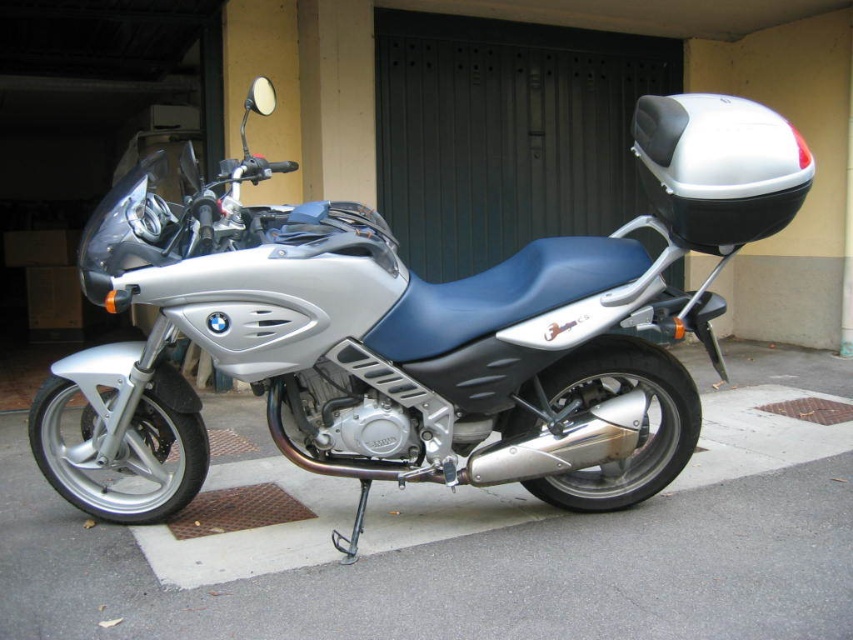
Is point (410, 310) positioned before point (453, 500)?

Yes, point (410, 310) is in front of point (453, 500).

Consider the image. Is silver metallic motorcycle at center shorter than silver asphalt pavement at lower center?

No.

This screenshot has height=640, width=853. What do you see at coordinates (415, 330) in the screenshot?
I see `silver metallic motorcycle at center` at bounding box center [415, 330].

Where is `silver metallic motorcycle at center`? Image resolution: width=853 pixels, height=640 pixels. silver metallic motorcycle at center is located at coordinates (415, 330).

Which of these two, silver metallic motorcycle at center or black metal/grey textured garage door at upper center, stands shorter?

silver metallic motorcycle at center

Is point (85, 257) behind point (569, 198)?

No, (85, 257) is in front of (569, 198).

Image resolution: width=853 pixels, height=640 pixels. What are the coordinates of `silver metallic motorcycle at center` in the screenshot? It's located at (415, 330).

Is silver asphalt pavement at lower center positioned in front of black metal/grey textured garage door at upper center?

Yes, it is in front of black metal/grey textured garage door at upper center.

Is point (155, 588) positioned after point (410, 113)?

That is False.

Which is in front, point (776, 602) or point (494, 243)?

Point (776, 602)

Where is `silver asphalt pavement at lower center`? The image size is (853, 640). silver asphalt pavement at lower center is located at coordinates (450, 561).